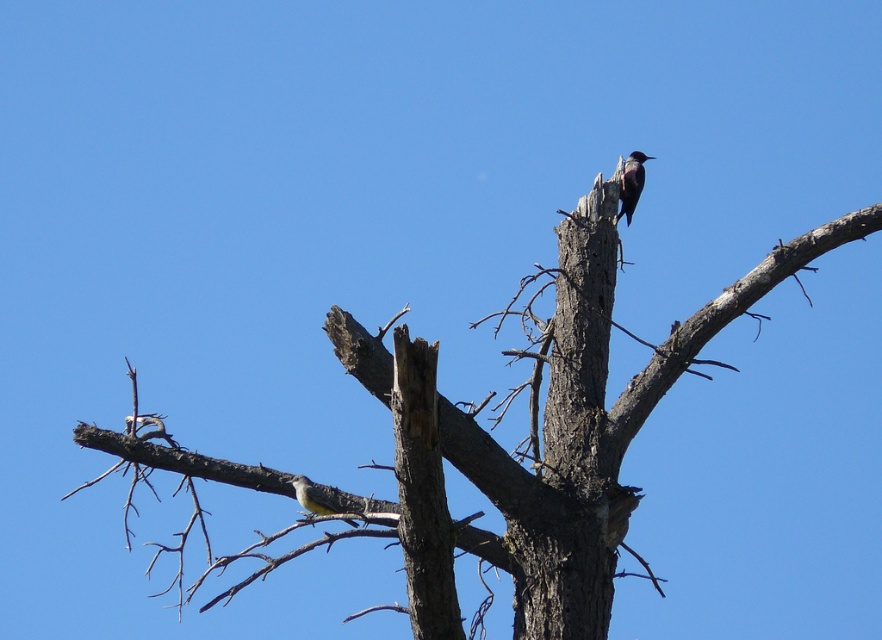
Question: Can you confirm if smooth bark tree trunk at upper center is smaller than shiny black woodpecker at upper right?

Choices:
 (A) no
 (B) yes

Answer: (A)

Question: Estimate the real-world distances between objects in this image. Which object is closer to the yellow-green feathers at center?

Choices:
 (A) smooth bark tree trunk at upper center
 (B) shiny black woodpecker at upper right

Answer: (A)

Question: Estimate the real-world distances between objects in this image. Which object is closer to the smooth bark tree trunk at upper center?

Choices:
 (A) yellow-green feathers at center
 (B) shiny black woodpecker at upper right

Answer: (B)

Question: Does smooth bark tree trunk at upper center have a smaller size compared to shiny black woodpecker at upper right?

Choices:
 (A) yes
 (B) no

Answer: (B)

Question: Can you confirm if smooth bark tree trunk at upper center is positioned to the left of shiny black woodpecker at upper right?

Choices:
 (A) no
 (B) yes

Answer: (B)

Question: Which object is closer to the camera taking this photo?

Choices:
 (A) shiny black woodpecker at upper right
 (B) smooth bark tree trunk at upper center
 (C) yellow-green feathers at center

Answer: (B)